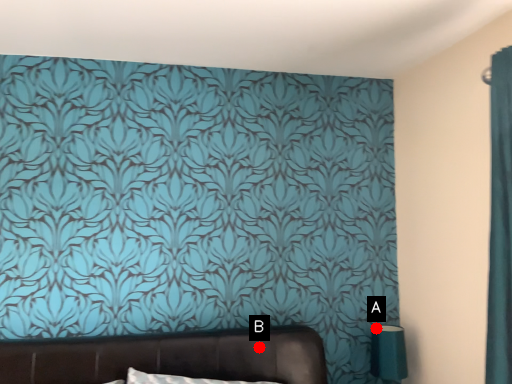
Question: Two points are circled on the image, labeled by A and B beside each circle. Among these points, which one is nearest to the camera?

Choices:
 (A) A is closer
 (B) B is closer

Answer: (B)